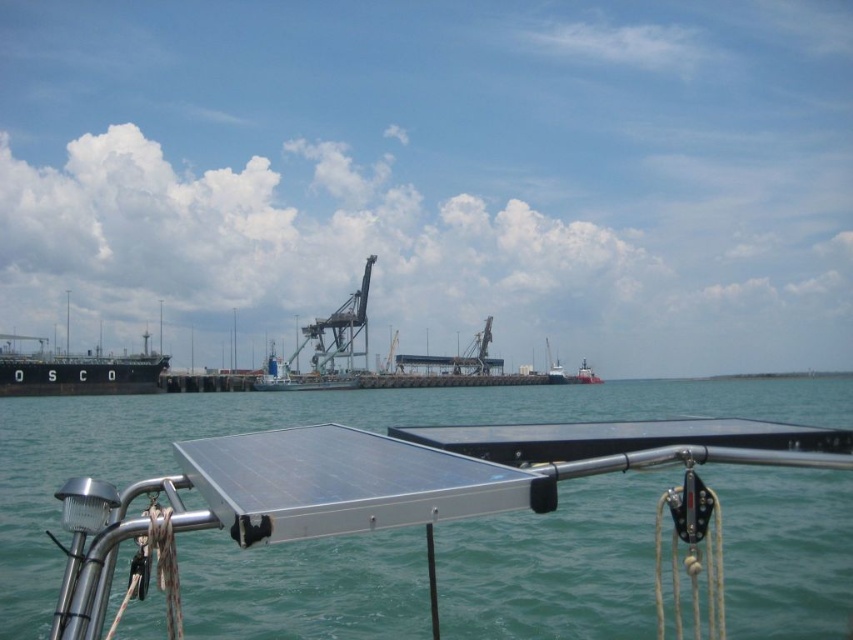
Can you confirm if black matte ship at left is positioned to the right of metallic gray crane at center?

In fact, black matte ship at left is to the left of metallic gray crane at center.

Which is above, black matte ship at left or metallic gray crane at center?

black matte ship at left is above.

Is point (49, 362) positioned after point (323, 380)?

No, it is in front of (323, 380).

Locate an element on the screen. black matte ship at left is located at coordinates point(76,371).

Is metallic blue water at center in front of metallic gray crane at center?

That is True.

Is point (636, 401) positioned after point (335, 346)?

No, (636, 401) is in front of (335, 346).

At what (x,y) coordinates should I click in order to perform the action: click on metallic blue water at center. Please return your answer as a coordinate pair (x, y). This screenshot has width=853, height=640. Looking at the image, I should click on (286, 420).

Between metallic blue water at center and black matte ship at left, which one has more height?

black matte ship at left is taller.

Does metallic blue water at center appear on the right side of black matte ship at left?

Correct, you'll find metallic blue water at center to the right of black matte ship at left.

What do you see at coordinates (286, 420) in the screenshot? This screenshot has height=640, width=853. I see `metallic blue water at center` at bounding box center [286, 420].

Locate an element on the screen. The image size is (853, 640). metallic blue water at center is located at coordinates (286, 420).